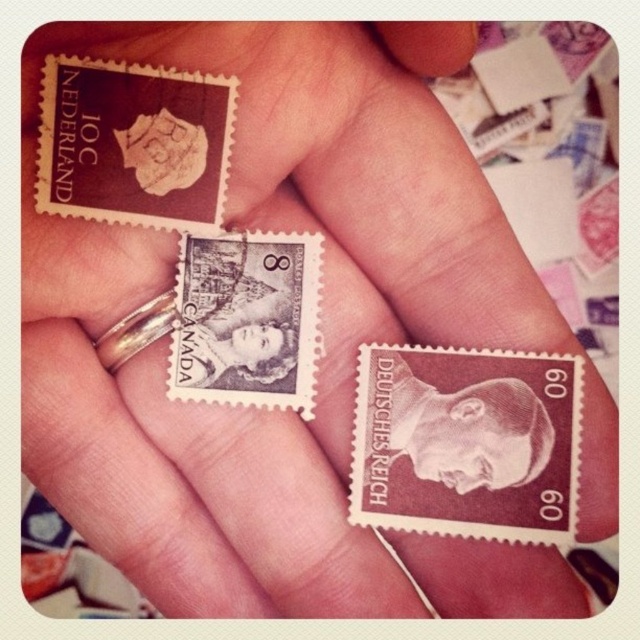
Can you confirm if brown paper stamp at upper left is bigger than smooth brown portrait at center?

Correct, brown paper stamp at upper left is larger in size than smooth brown portrait at center.

Can you confirm if brown paper stamp at upper left is wider than smooth brown portrait at center?

Indeed, brown paper stamp at upper left has a greater width compared to smooth brown portrait at center.

Is point (154, 227) farther from viewer compared to point (540, 467)?

Yes, it is behind point (540, 467).

Where is `brown paper stamp at upper left`? brown paper stamp at upper left is located at coordinates (132, 144).

Which is below, brown paper stamp at center or black paper stamp at center?

Positioned lower is brown paper stamp at center.

Is brown paper stamp at center to the right of black paper stamp at center from the viewer's perspective?

Yes, brown paper stamp at center is to the right of black paper stamp at center.

Which is in front, point (481, 394) or point (216, 266)?

Point (481, 394) is in front.

This screenshot has width=640, height=640. Identify the location of brown paper stamp at center. (467, 442).

Can you confirm if brown paper stamp at center is positioned to the right of brown paper stamp at upper left?

Indeed, brown paper stamp at center is positioned on the right side of brown paper stamp at upper left.

Is brown paper stamp at center bigger than brown paper stamp at upper left?

Yes.

You are a GUI agent. You are given a task and a screenshot of the screen. Output one action in this format:
    pyautogui.click(x=<x>, y=<y>)
    Task: Click on the brown paper stamp at center
    The width and height of the screenshot is (640, 640).
    Given the screenshot: What is the action you would take?
    [x=467, y=442]